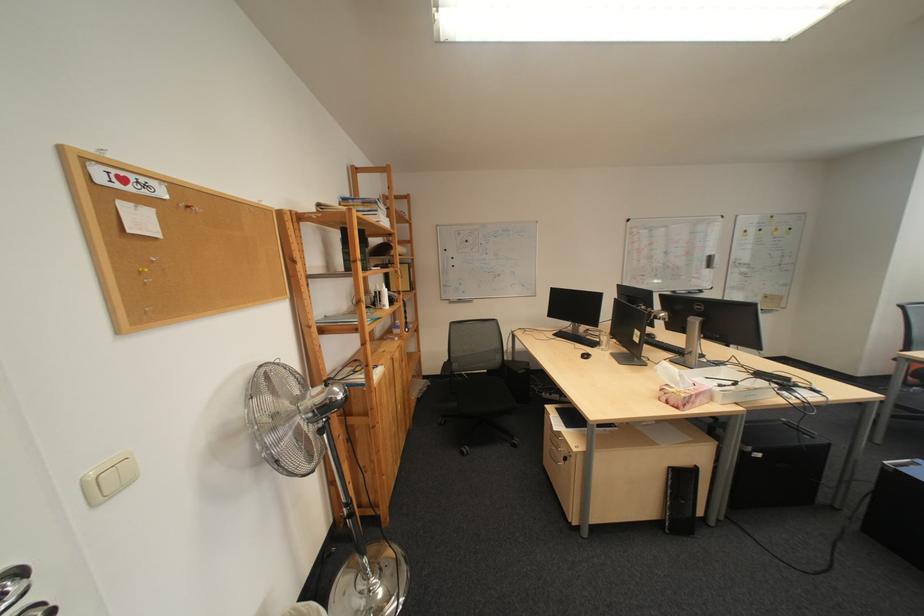
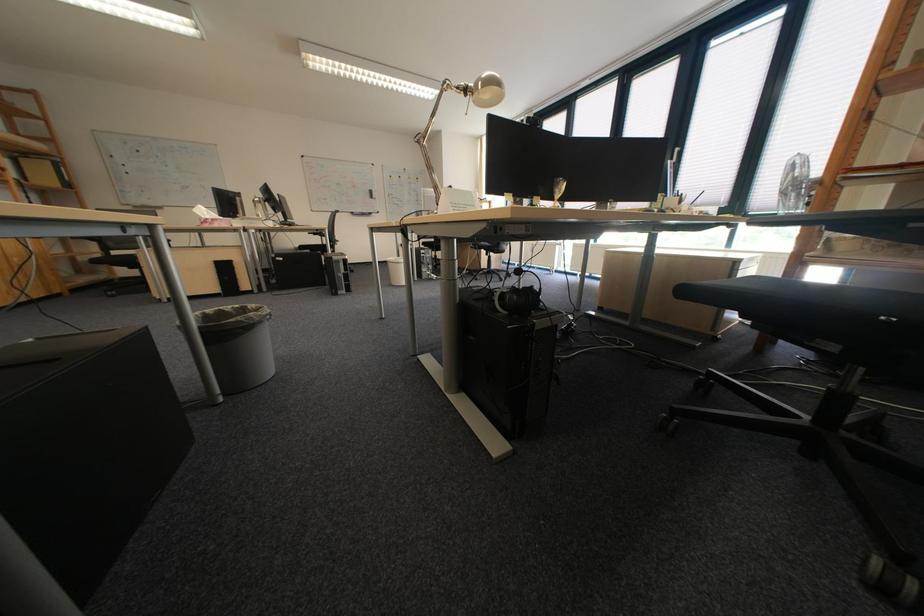
What movement of the cameraman would produce the second image?

The cameraman moved toward right, backward.